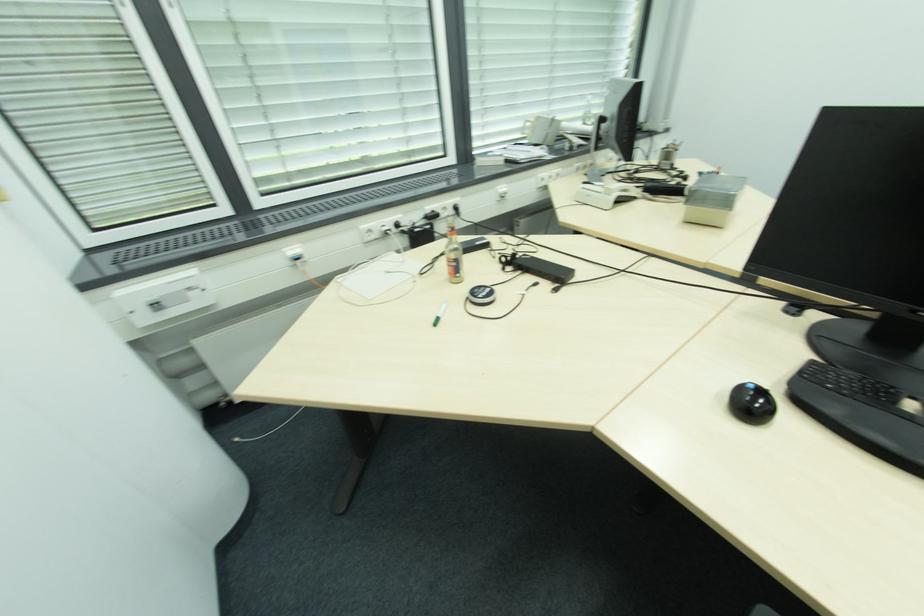
Where is `black round container`? Image resolution: width=924 pixels, height=616 pixels. black round container is located at coordinates pos(751,403).